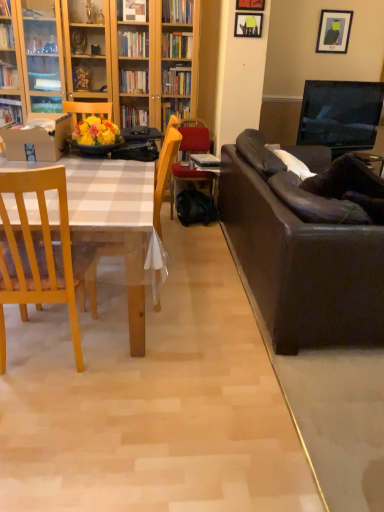
Question: Is wooden picture frame at upper center, placed as the 2th picture frame when sorted from right to left, to the left or to the right of light wood chair at left, the first chair in the front-to-back sequence, in the image?

Choices:
 (A) right
 (B) left

Answer: (A)

Question: From a real-world perspective, is wooden picture frame at upper center, which ranks as the third picture frame in back-to-front order, above or below light wood chair at left, the first chair in the front-to-back sequence?

Choices:
 (A) above
 (B) below

Answer: (A)

Question: Based on their relative distances, which object is farther from the matte black picture frame at upper right, placed as the first picture frame when sorted from right to left?

Choices:
 (A) wooden chair at center, positioned as the first chair in back-to-front order
 (B) hardcover book at center
 (C) matte cardboard box at left
 (D) wooden picture frame at upper center, placed as the 2th picture frame when sorted from right to left
 (E) wooden chair at center, the second chair from the back

Answer: (C)

Question: Which object is positioned farthest from the wooden picture frame at upper center, the 1th picture frame positioned from the front?

Choices:
 (A) hardcover book at center
 (B) wooden chair at center, the second chair from the back
 (C) light wood chair at left, the first chair in the front-to-back sequence
 (D) matte black picture frame at upper center, which ranks as the second picture frame in back-to-front order
 (E) leather couch at right

Answer: (C)